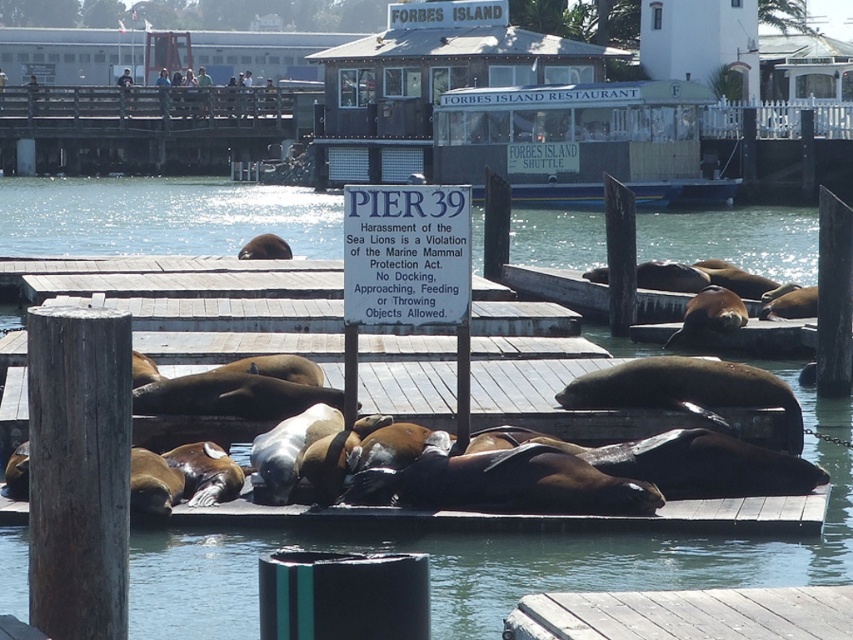
Who is more forward, (33, 240) or (646, 602)?

Point (646, 602)

Identify the location of clear water at dock center. (477, 566).

Which is more to the right, white plastic sign at center or wooden dock at lower center?

wooden dock at lower center

Is point (350, 394) farther from viewer compared to point (683, 600)?

Yes, it is.

Who is more forward, (347, 378) or (544, 609)?

Point (544, 609) is more forward.

Identify the location of white plastic sign at center. The width and height of the screenshot is (853, 640). (407, 273).

Is white plastic boat at upper center positioned at the back of wooden dock at lower center?

Yes, white plastic boat at upper center is further from the viewer.

Can you confirm if white plastic boat at upper center is wider than wooden dock at lower center?

Yes, white plastic boat at upper center is wider than wooden dock at lower center.

Locate an element on the screen. This screenshot has height=640, width=853. white plastic boat at upper center is located at coordinates (503, 113).

Locate an element on the screen. The image size is (853, 640). white plastic boat at upper center is located at coordinates (503, 113).